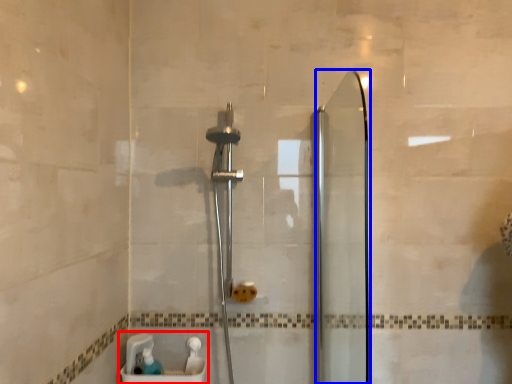
Question: Which object is closer to the camera taking this photo, sink (highlighted by a red box) or screen door (highlighted by a blue box)?

Choices:
 (A) sink
 (B) screen door

Answer: (B)